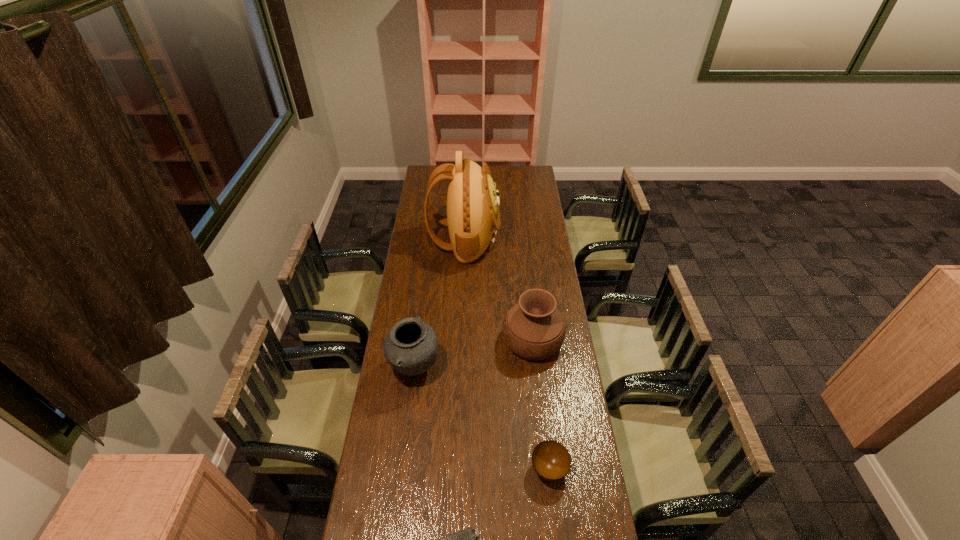
At what (x,y) coordinates should I click in order to perform the action: click on vacant space that satisfies the following two spatial constraints: 1. on the back side of the right urn; 2. on the front-facing side of the farthest object. Please return your answer as a coordinate pair (x, y). Looking at the image, I should click on (x=522, y=240).